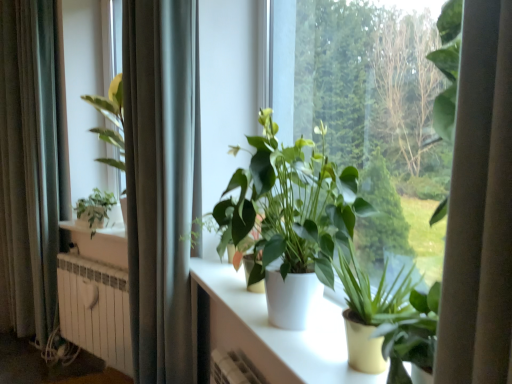
Describe the element at coordinates (95, 207) in the screenshot. This screenshot has height=384, width=512. I see `green matte plant at left, acting as the 1th houseplant starting from the back` at that location.

Measure the distance between point (297, 276) and camera.

The distance of point (297, 276) from camera is 1.21 meters.

What do you see at coordinates (290, 221) in the screenshot? I see `white matte plant pot at center, which appears as the 2th houseplant when viewed from the front` at bounding box center [290, 221].

Measure the distance between white metallic radiator at lower left and camera.

They are 2.32 meters apart.

Describe the element at coordinates (95, 309) in the screenshot. I see `white metallic radiator at lower left` at that location.

Where is `silky gray curtain at left, which ranks as the 1th curtain in left-to-right order`? This screenshot has width=512, height=384. silky gray curtain at left, which ranks as the 1th curtain in left-to-right order is located at coordinates (28, 169).

Which of these two, silky gray curtain at left, arranged as the first curtain when viewed from the back, or green matte plant at center, which is the 3th houseplant from left to right, is smaller?

green matte plant at center, which is the 3th houseplant from left to right.

Is silky gray curtain at left, which is counted as the 2th curtain, starting from the front, looking in the opposite direction of green matte plant at center, the first houseplant in the front-to-back sequence?

No.

Considering the positions of objects silky gray curtain at left, arranged as the first curtain when viewed from the back, and green matte plant at center, which is the 3th houseplant from left to right, in the image provided, who is more to the left, silky gray curtain at left, arranged as the first curtain when viewed from the back, or green matte plant at center, which is the 3th houseplant from left to right,?

From the viewer's perspective, silky gray curtain at left, arranged as the first curtain when viewed from the back, appears more on the left side.

From a real-world perspective, which is physically below, silky gray curtain at left, which is counted as the 2th curtain, starting from the front, or green matte plant at center, the third houseplant when ordered from back to front?

In real-world perspective, green matte plant at center, the third houseplant when ordered from back to front, is lower.

How many degrees apart are the facing directions of white glossy table at center and white metallic radiator at lower left?

28.4 degrees.

Does point (213, 309) lie behind point (82, 273)?

That is False.

Looking at this image, is white glossy table at center spatially inside white metallic radiator at lower left, or outside of it?

white glossy table at center lies outside white metallic radiator at lower left.

How distant is white glossy table at center from white metallic radiator at lower left?

white glossy table at center and white metallic radiator at lower left are 95.18 centimeters apart from each other.

Is gray fabric curtain at left, which ranks as the first curtain in right-to-left order, far away from silky gray curtain at left, arranged as the first curtain when viewed from the back?

Yes, gray fabric curtain at left, which ranks as the first curtain in right-to-left order, and silky gray curtain at left, arranged as the first curtain when viewed from the back, are located far from each other.

From the image's perspective, is gray fabric curtain at left, placed as the 2th curtain when sorted from back to front, over silky gray curtain at left, arranged as the first curtain when viewed from the back?

Incorrect, from the image's perspective, gray fabric curtain at left, placed as the 2th curtain when sorted from back to front, is lower than silky gray curtain at left, arranged as the first curtain when viewed from the back.

Consider the image. Considering the relative positions of gray fabric curtain at left, which ranks as the first curtain in right-to-left order, and silky gray curtain at left, the second curtain in the right-to-left sequence, in the image provided, is gray fabric curtain at left, which ranks as the first curtain in right-to-left order, behind silky gray curtain at left, the second curtain in the right-to-left sequence,?

No, gray fabric curtain at left, which ranks as the first curtain in right-to-left order, is closer to the camera.

Measure the distance between white matte plant pot at center, which appears as the 2th houseplant when viewed from the front, and green matte plant at left, which is the first houseplant from left to right.

They are 1.77 meters apart.

Considering the sizes of objects white matte plant pot at center, which is counted as the second houseplant, starting from the right, and green matte plant at left, the 3th houseplant positioned from the front, in the image provided, who is bigger, white matte plant pot at center, which is counted as the second houseplant, starting from the right, or green matte plant at left, the 3th houseplant positioned from the front,?

white matte plant pot at center, which is counted as the second houseplant, starting from the right.

In the image, is white matte plant pot at center, which is counted as the second houseplant, starting from the right, on the left side or the right side of green matte plant at left, acting as the 1th houseplant starting from the back?

Clearly, white matte plant pot at center, which is counted as the second houseplant, starting from the right, is on the right of green matte plant at left, acting as the 1th houseplant starting from the back, in the image.

Considering their positions, is white matte plant pot at center, positioned as the 2th houseplant in left-to-right order, located in front of or behind green matte plant at left, marked as the third houseplant in a right-to-left arrangement?

In the image, white matte plant pot at center, positioned as the 2th houseplant in left-to-right order, appears in front of green matte plant at left, marked as the third houseplant in a right-to-left arrangement.

From the image's perspective, would you say silky gray curtain at left, which is counted as the 2th curtain, starting from the front, is positioned over gray fabric curtain at left, the second curtain in the left-to-right sequence?

Indeed, from the image's perspective, silky gray curtain at left, which is counted as the 2th curtain, starting from the front, is shown above gray fabric curtain at left, the second curtain in the left-to-right sequence.

From a real-world perspective, is silky gray curtain at left, which ranks as the 1th curtain in left-to-right order, located beneath gray fabric curtain at left, which ranks as the first curtain in right-to-left order?

No, from a real-world perspective, silky gray curtain at left, which ranks as the 1th curtain in left-to-right order, is not under gray fabric curtain at left, which ranks as the first curtain in right-to-left order.

Which is behind, point (49, 212) or point (198, 196)?

The point (49, 212) is behind.

At what (x,y) coordinates should I click in order to perform the action: click on houseplant on the right of white matte plant pot at center, which is counted as the second houseplant, starting from the right. Please return your answer as a coordinate pair (x, y). Looking at the image, I should click on (394, 317).

From a real-world perspective, which object rests below the other?

green matte plant at center, the third houseplant when ordered from back to front, is physically lower.

From the image's perspective, which is below, green matte plant at center, which is the 3th houseplant from left to right, or white matte plant pot at center, the second houseplant from the back?

green matte plant at center, which is the 3th houseplant from left to right, from the image's perspective.

Considering the sizes of green matte plant at center, the third houseplant when ordered from back to front, and white matte plant pot at center, which appears as the 2th houseplant when viewed from the front, in the image, is green matte plant at center, the third houseplant when ordered from back to front, wider or thinner than white matte plant pot at center, which appears as the 2th houseplant when viewed from the front,?

In the image, green matte plant at center, the third houseplant when ordered from back to front, appears to be more narrow than white matte plant pot at center, which appears as the 2th houseplant when viewed from the front.

Which houseplant is the 1st one when counting from the left side of the green matte plant at center, which is the 3th houseplant from left to right? Please provide its 2D coordinates.

[(290, 221)]

Considering the positions of objects white matte plant pot at center, which is counted as the second houseplant, starting from the right, and green matte plant at center, the third houseplant when ordered from back to front, in the image provided, who is more to the left, white matte plant pot at center, which is counted as the second houseplant, starting from the right, or green matte plant at center, the third houseplant when ordered from back to front,?

Positioned to the left is white matte plant pot at center, which is counted as the second houseplant, starting from the right.

Is white matte plant pot at center, positioned as the 2th houseplant in left-to-right order, touching green matte plant at center, the first houseplant in the front-to-back sequence?

white matte plant pot at center, positioned as the 2th houseplant in left-to-right order, and green matte plant at center, the first houseplant in the front-to-back sequence, are clearly separated.

Locate an element on the screen. Image resolution: width=512 pixels, height=384 pixels. curtain that is the 2nd one when counting backward from the green matte plant at center, the first houseplant in the front-to-back sequence is located at coordinates (28, 169).

At what (x,y) coordinates should I click in order to perform the action: click on radiator below the white glossy table at center (from the image's perspective). Please return your answer as a coordinate pair (x, y). The image size is (512, 384). Looking at the image, I should click on (95, 309).

Estimate the real-world distances between objects in this image. Which object is closer to gray fabric curtain at left, which ranks as the first curtain in right-to-left order, silky gray curtain at left, which ranks as the 1th curtain in left-to-right order, or white metallic radiator at lower left?

white metallic radiator at lower left.

Estimate the real-world distances between objects in this image. Which object is further from white matte plant pot at center, which appears as the 2th houseplant when viewed from the front, gray fabric curtain at left, which ranks as the first curtain in right-to-left order, or white glossy table at center?

The object further to white matte plant pot at center, which appears as the 2th houseplant when viewed from the front, is gray fabric curtain at left, which ranks as the first curtain in right-to-left order.

Estimate the real-world distances between objects in this image. Which object is closer to green matte plant at center, the 1th houseplant from the right, gray fabric curtain at left, the first curtain when ordered from front to back, or silky gray curtain at left, the second curtain in the right-to-left sequence?

gray fabric curtain at left, the first curtain when ordered from front to back.

Which object lies further to the anchor point gray fabric curtain at left, which ranks as the first curtain in right-to-left order, green matte plant at center, the 1th houseplant from the right, or white metallic radiator at lower left?

green matte plant at center, the 1th houseplant from the right.

Estimate the real-world distances between objects in this image. Which object is further from white matte plant pot at center, the second houseplant from the back, silky gray curtain at left, which ranks as the 1th curtain in left-to-right order, or gray fabric curtain at left, the first curtain when ordered from front to back?

silky gray curtain at left, which ranks as the 1th curtain in left-to-right order, is further to white matte plant pot at center, the second houseplant from the back.

Which object lies nearer to the anchor point white metallic radiator at lower left, gray fabric curtain at left, which ranks as the first curtain in right-to-left order, or white glossy table at center?

gray fabric curtain at left, which ranks as the first curtain in right-to-left order, is positioned closer to the anchor white metallic radiator at lower left.

Which object lies further to the anchor point gray fabric curtain at left, the first curtain when ordered from front to back, white matte plant pot at center, which appears as the 2th houseplant when viewed from the front, or white glossy table at center?

white matte plant pot at center, which appears as the 2th houseplant when viewed from the front, is further to gray fabric curtain at left, the first curtain when ordered from front to back.

When comparing their distances from white matte plant pot at center, positioned as the 2th houseplant in left-to-right order, does green matte plant at center, the 1th houseplant from the right, or white glossy table at center seem further?

Based on the image, white glossy table at center appears to be further to white matte plant pot at center, positioned as the 2th houseplant in left-to-right order.

Identify the location of houseplant between green matte plant at center, the third houseplant when ordered from back to front, and green matte plant at left, acting as the 1th houseplant starting from the back, in the front-back direction. This screenshot has height=384, width=512. (290, 221).

Identify the location of table positioned between green matte plant at center, the first houseplant in the front-to-back sequence, and white metallic radiator at lower left from near to far. (269, 332).

The width and height of the screenshot is (512, 384). I want to click on houseplant located between silky gray curtain at left, which is counted as the 2th curtain, starting from the front, and gray fabric curtain at left, which ranks as the first curtain in right-to-left order, in the left-right direction, so click(95, 207).

Where is `radiator between silky gray curtain at left, which ranks as the 1th curtain in left-to-right order, and green matte plant at center, the first houseplant in the front-to-back sequence`? The height and width of the screenshot is (384, 512). radiator between silky gray curtain at left, which ranks as the 1th curtain in left-to-right order, and green matte plant at center, the first houseplant in the front-to-back sequence is located at coordinates (95, 309).